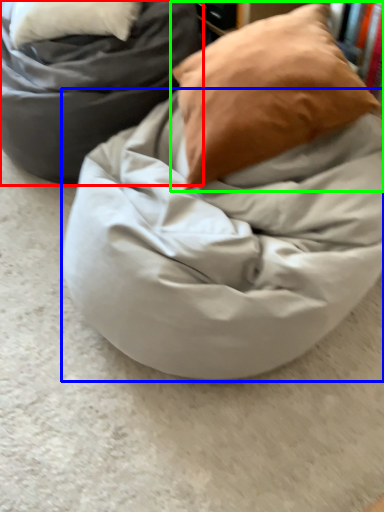
Question: Based on their relative distances, which object is farther from furniture (highlighted by a red box)? Choose from blanket (highlighted by a blue box) and pillow (highlighted by a green box).

Choices:
 (A) blanket
 (B) pillow

Answer: (A)